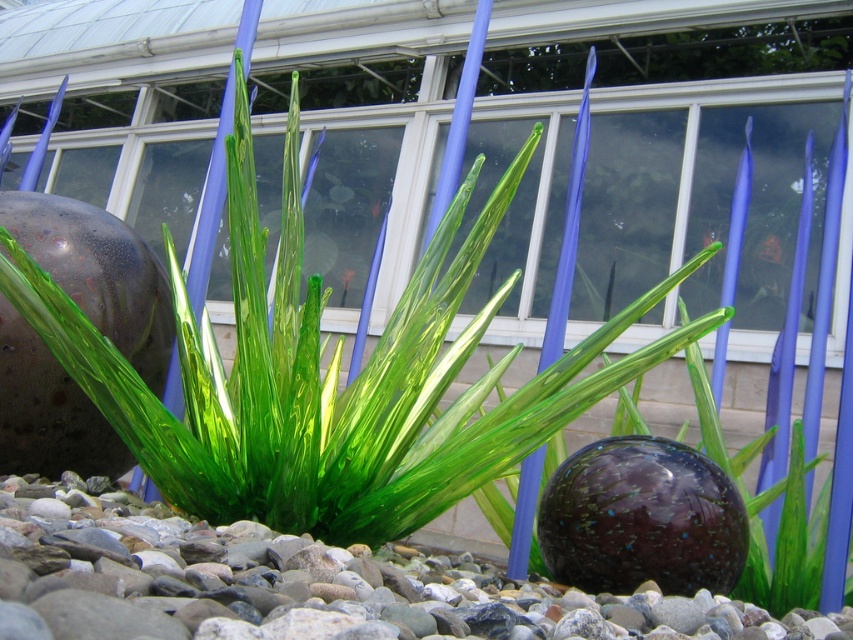
You are a photographer standing in the garden and want to capture a clear photo of the green glass plant at center and the smooth pebbles at center. Which object should you focus on first to ensure both are in focus?

You should focus on the green glass plant at center first because it is closer to you than the smooth pebbles at center, so focusing on it will ensure the pebbles are also in focus as they are behind it.

You are a gardener who wants to plant a new flower in the garden. You see the green glass plant at center and the smooth pebbles at center. Which object is located above the other?

The green glass plant at center is positioned over smooth pebbles at center, so the green glass plant is above the pebbles.

You are holding a camera and want to take a photo of the green glass plant at center. If you are standing 1.20 meters away from it, will you be able to capture the entire plant in your shot without moving closer or farther?

The green glass plant at center and camera are 1.20 meters apart from each other. Whether the entire plant can be captured depends on the camera lens used. However, the provided information does not specify the camera lens type or field of view, so it cannot be determined with certainty.